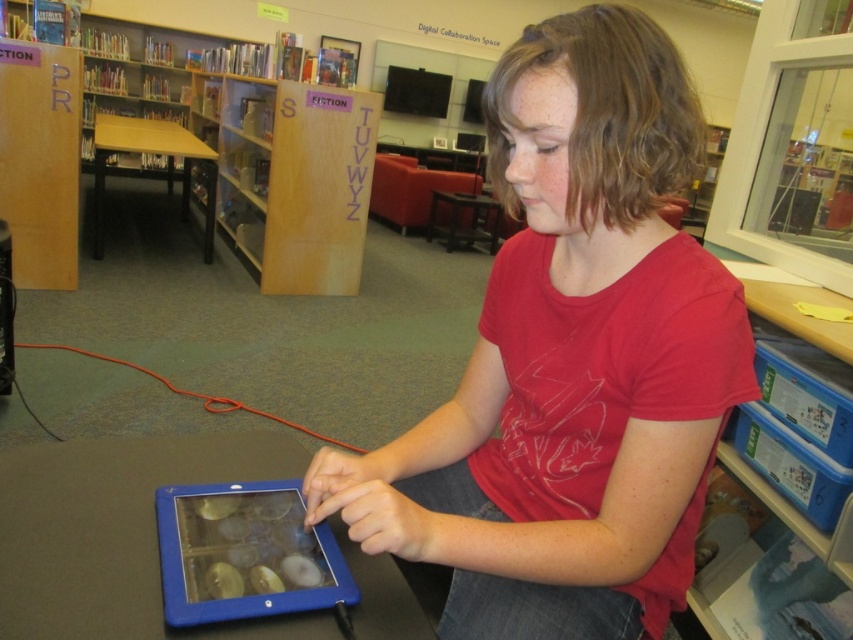
Question: Which point appears closest to the camera in this image?

Choices:
 (A) (637, 449)
 (B) (206, 513)

Answer: (A)

Question: Does matte red shirt at center come in front of blue rubberized tablet computer at center?

Choices:
 (A) yes
 (B) no

Answer: (B)

Question: Can you confirm if matte red shirt at center is thinner than blue rubberized tablet computer at center?

Choices:
 (A) yes
 (B) no

Answer: (B)

Question: Which object is farther from the camera taking this photo?

Choices:
 (A) matte red shirt at center
 (B) blue rubberized tablet computer at center

Answer: (A)

Question: Can you confirm if matte red shirt at center is positioned to the left of blue rubberized tablet computer at center?

Choices:
 (A) yes
 (B) no

Answer: (B)